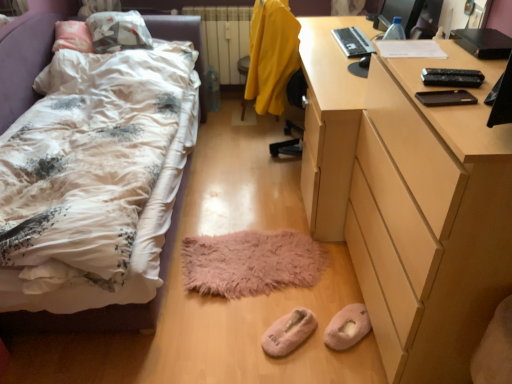
The height and width of the screenshot is (384, 512). Identify the location of free space above pink fluffy slippers at lower center, which is the second footwear in left-to-right order (from a real-world perspective). (350, 316).